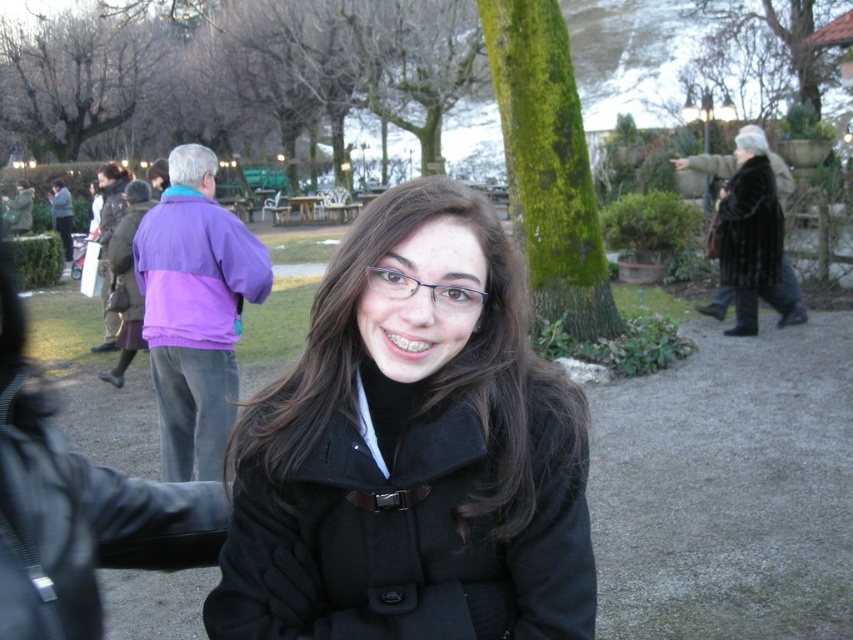
Question: Among these objects, which one is nearest to the camera?

Choices:
 (A) black wool coat at center
 (B) purple fleece jacket at upper left
 (C) smooth gray stone hand at upper right

Answer: (A)

Question: Is the position of velvet brown coat at upper right less distant than that of purple fleece jacket at left?

Choices:
 (A) no
 (B) yes

Answer: (A)

Question: Based on their relative distances, which object is farther from the velvet brown coat at upper right?

Choices:
 (A) black wool coat at center
 (B) black fur coat at right

Answer: (A)

Question: Observing the image, what is the correct spatial positioning of black matte coat at lower left in reference to velvet brown coat at upper right?

Choices:
 (A) below
 (B) above

Answer: (A)

Question: Is black matte coat at lower left smaller than purple fleece jacket at upper left?

Choices:
 (A) no
 (B) yes

Answer: (B)

Question: Which of the following is the farthest from the observer?

Choices:
 (A) velvet brown coat at upper right
 (B) smooth gray stone hand at upper right
 (C) purple fleece jacket at upper left
 (D) black wool coat at center

Answer: (A)